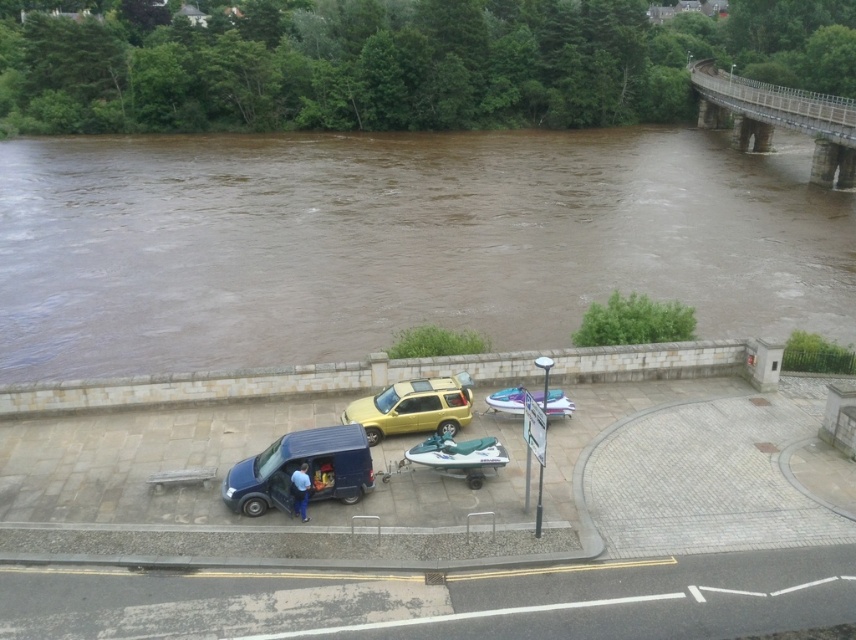
You are a delivery person needing to access the yellow matte suv at center to load packages. Is the matte black van at lower left blocking your path to the suv?

The matte black van at lower left is positioned under the yellow matte suv at center, which means the van is directly beneath the suv. Since the suv is above the van in this arrangement, the van is not blocking the path to the suv. You can access the suv without any obstruction from the van.

You are planning to cross the concrete gray bridge at upper right with a truck that is as wide as the white glossy jet ski at center. Will the truck fit on the bridge?

The concrete gray bridge at upper right is wider than the white glossy jet ski at center, so the truck, which is as wide as the jet ski, will fit on the bridge.

You are a delivery person who needs to park your 2.5 meter wide truck in this area. There is a yellow matte suv at center and a white glossy jet ski at center present. Can your truck fit between them if they are parked side by side?

The yellow matte suv at center is wider than the white glossy jet ski at center. Since the truck is 2.5 meters wide, it depends on the combined space between them. However, without knowing the exact distance between the vehicles, we can only confirm that the SUV is wider, but cannot determine if the truck will fit.